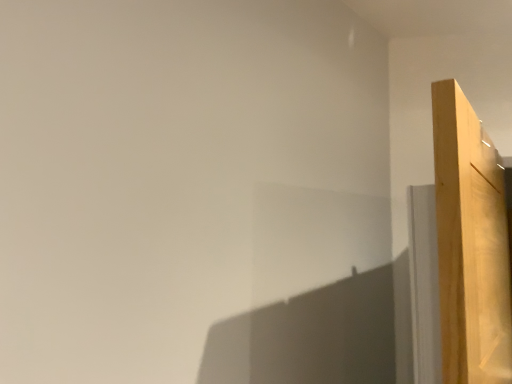
At what (x,y) coordinates should I click in order to perform the action: click on light wood door at right. Please return your answer as a coordinate pair (x, y). The height and width of the screenshot is (384, 512). Looking at the image, I should click on [x=470, y=244].

Describe the element at coordinates (470, 244) in the screenshot. I see `light wood door at right` at that location.

Locate an element on the screen. The image size is (512, 384). light wood door at right is located at coordinates (470, 244).